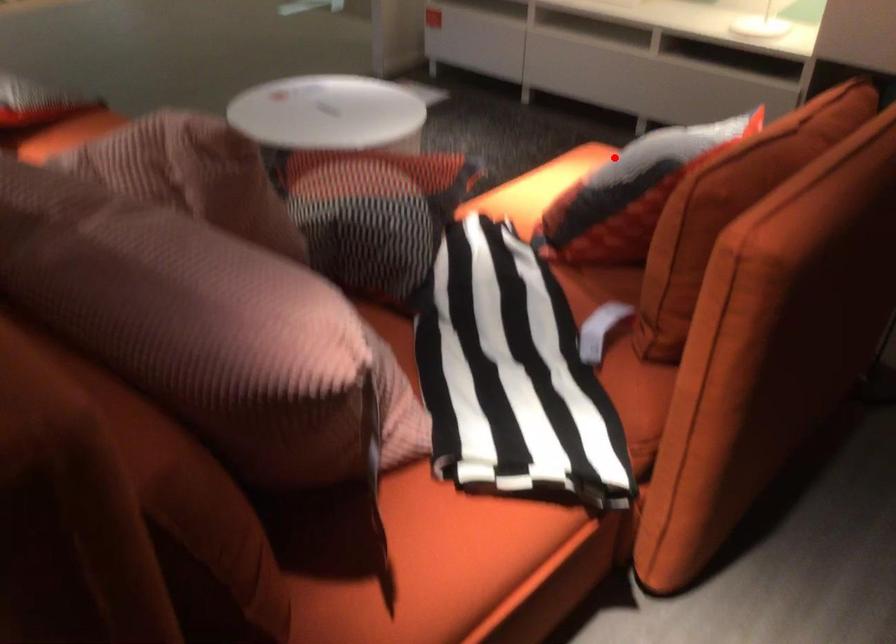
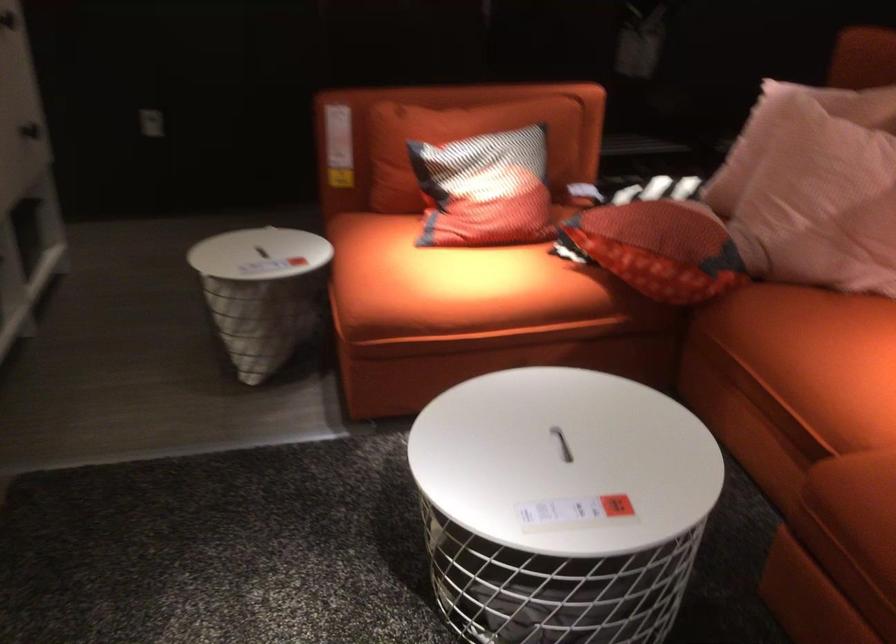
Question: I am providing you with two images of the same scene from different viewpoints. Given a red point in image1, look at the same physical point in image2. Is it:

Choices:
 (A) Closer to the viewpoint
 (B) Farther from the viewpoint

Answer: (B)